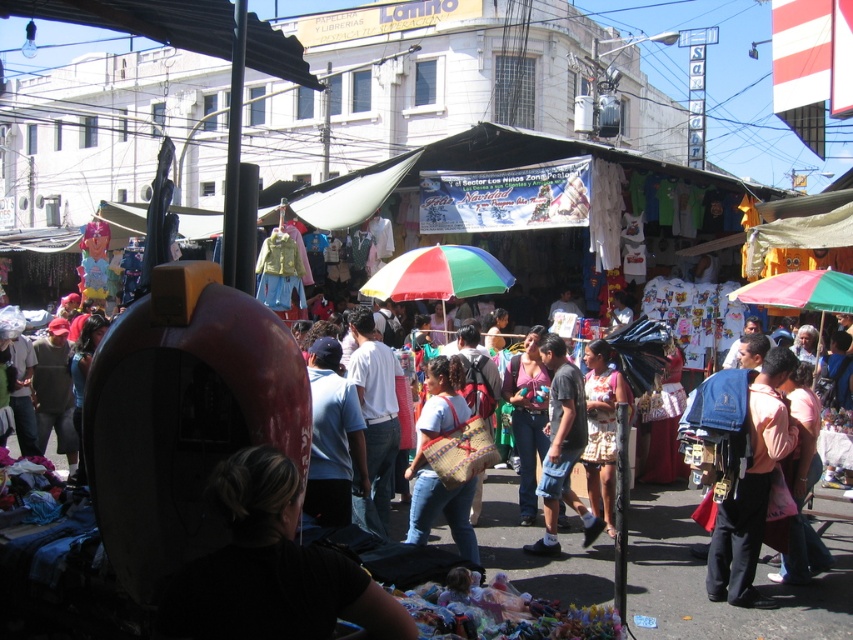
You are a tourist in the market and want to take a photo of the rainbow fabric umbrella at center without the pink fabric backpack at lower right blocking it. What should you do?

Move to the side opposite of the pink fabric backpack at lower right so that the rainbow fabric umbrella at center is no longer blocked.

You are a customer at the market and want to pick up both the pink fabric backpack at lower right and the woven fabric bag at center. Which item should you grab first to reach them in order from left to right?

The woven fabric bag at center is on the left side of the pink fabric backpack at lower right, so you should grab the woven fabric bag at center first to follow the left to right order.

You are standing at the point marked by the coordinates [752,488] in the market scene. What object is located at this position?

The pink fabric backpack at lower right is located at the coordinates [752,488].